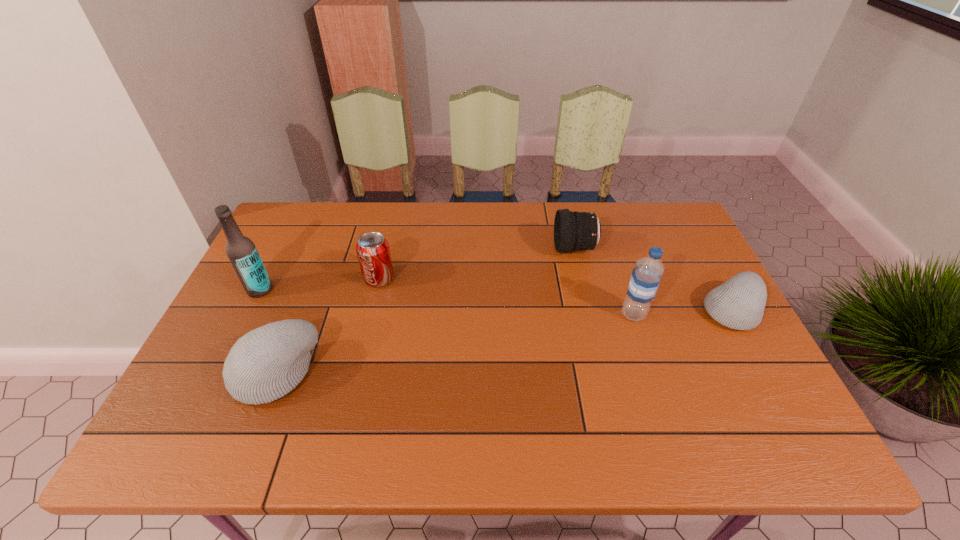
At what (x,y) coordinates should I click in order to perform the action: click on free space located on the back of the taller beanie. Please return your answer as a coordinate pair (x, y). The image size is (960, 540). Looking at the image, I should click on (321, 258).

At what (x,y) coordinates should I click in order to perform the action: click on blank area located on the front of the shorter beanie. Please return your answer as a coordinate pair (x, y). The height and width of the screenshot is (540, 960). Looking at the image, I should click on (763, 369).

Find the location of a particular element. The image size is (960, 540). free space located 0.130m at the front element of the fourth object from left to right is located at coordinates (514, 248).

At what (x,y) coordinates should I click in order to perform the action: click on vacant space situated at the front element of the fourth object from left to right. Please return your answer as a coordinate pair (x, y). Looking at the image, I should click on (427, 248).

I want to click on free space located at the front element of the fourth object from left to right, so click(500, 248).

At what (x,y) coordinates should I click in order to perform the action: click on vacant area situated on the label of the fifth shortest object. Please return your answer as a coordinate pair (x, y). The height and width of the screenshot is (540, 960). Looking at the image, I should click on (531, 314).

What are the coordinates of `vacant region located 0.270m on the label of the fifth shortest object` in the screenshot? It's located at (519, 314).

Where is `vacant space located on the label of the fifth shortest object`? vacant space located on the label of the fifth shortest object is located at coordinates (x=564, y=314).

Find the location of a particular element. Image resolution: width=960 pixels, height=540 pixels. free space located on the back of the soda can is located at coordinates (388, 242).

Locate an element on the screen. vacant region located 0.290m on the side of the tallest object with the label is located at coordinates (209, 390).